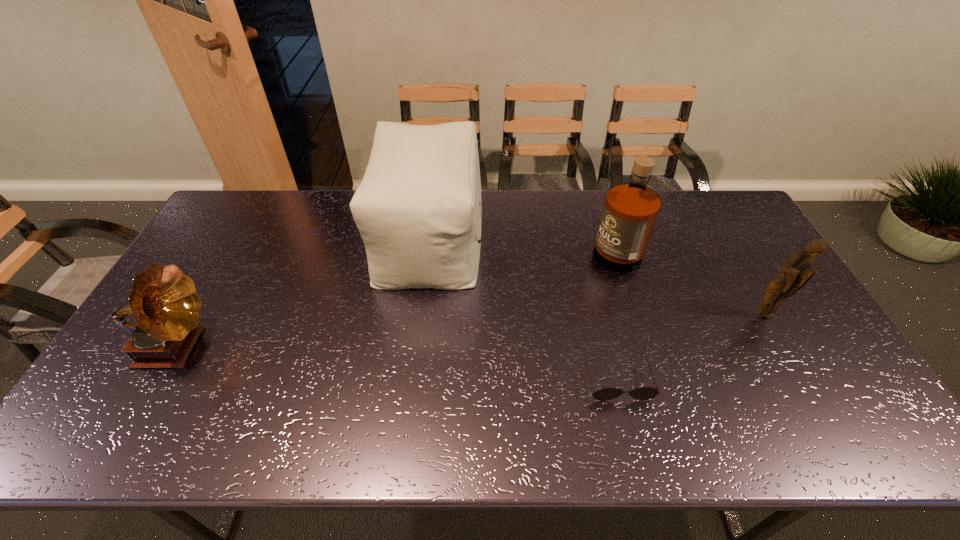
The width and height of the screenshot is (960, 540). Find the location of `liquor`. liquor is located at coordinates (630, 211).

I want to click on cushion, so click(x=418, y=209).

At what (x,y) coordinates should I click in order to perform the action: click on figurine. Please return your answer as a coordinate pair (x, y). The width and height of the screenshot is (960, 540). Looking at the image, I should click on (795, 272).

Locate an element on the screen. The width and height of the screenshot is (960, 540). the leftmost object is located at coordinates (164, 301).

The image size is (960, 540). I want to click on sunglasses, so click(x=644, y=393).

The height and width of the screenshot is (540, 960). I want to click on vacant region located 0.160m on the front label of the liquor, so click(x=541, y=244).

You are a GUI agent. You are given a task and a screenshot of the screen. Output one action in this format:
    pyautogui.click(x=<x>, y=<y>)
    Task: Click on the free space located 0.350m on the front label of the liquor
    The width and height of the screenshot is (960, 540).
    Given the screenshot: What is the action you would take?
    pyautogui.click(x=485, y=244)

Image resolution: width=960 pixels, height=540 pixels. What are the coordinates of `free location located on the front label of the liquor` in the screenshot? It's located at (475, 244).

The height and width of the screenshot is (540, 960). Identify the location of free spot located on the side of the fourth object from right to left with the smiley face. (535, 240).

The height and width of the screenshot is (540, 960). I want to click on blank space located on the front-facing side of the rightmost object, so click(826, 422).